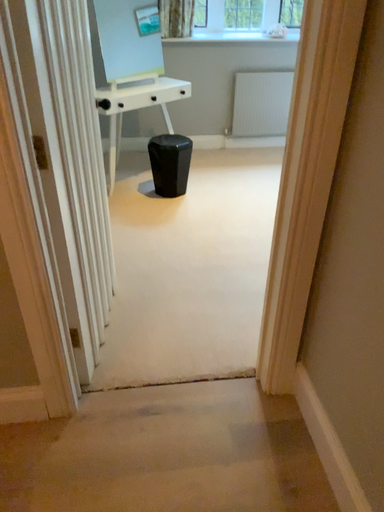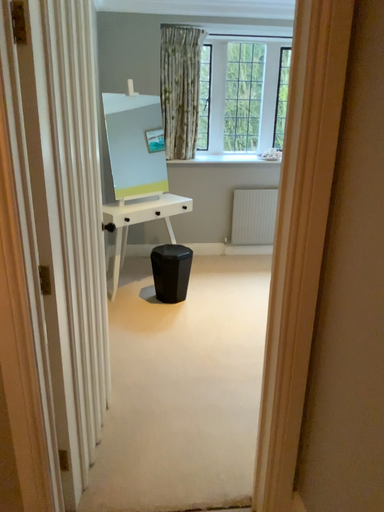
Question: Which way did the camera rotate in the video?

Choices:
 (A) rotated upward
 (B) rotated downward

Answer: (A)